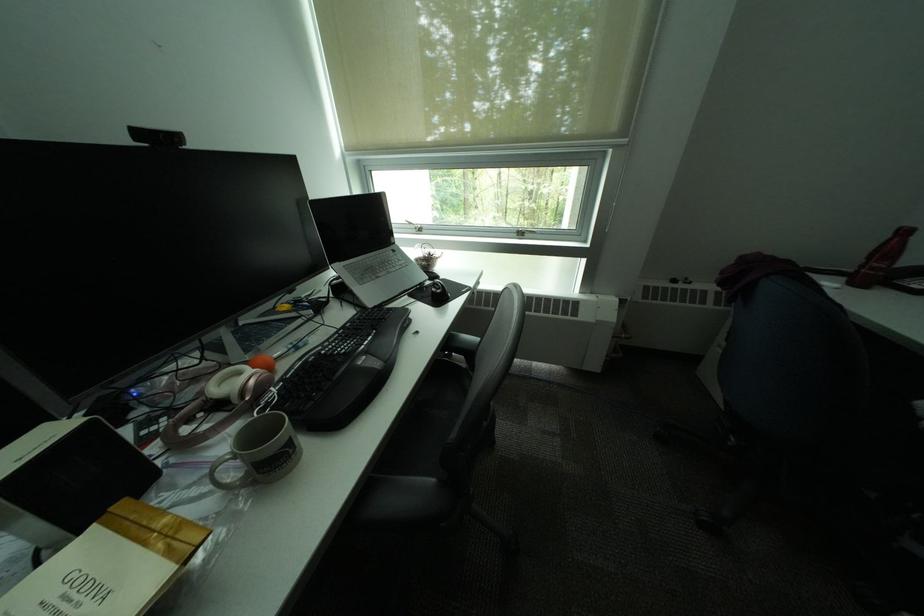
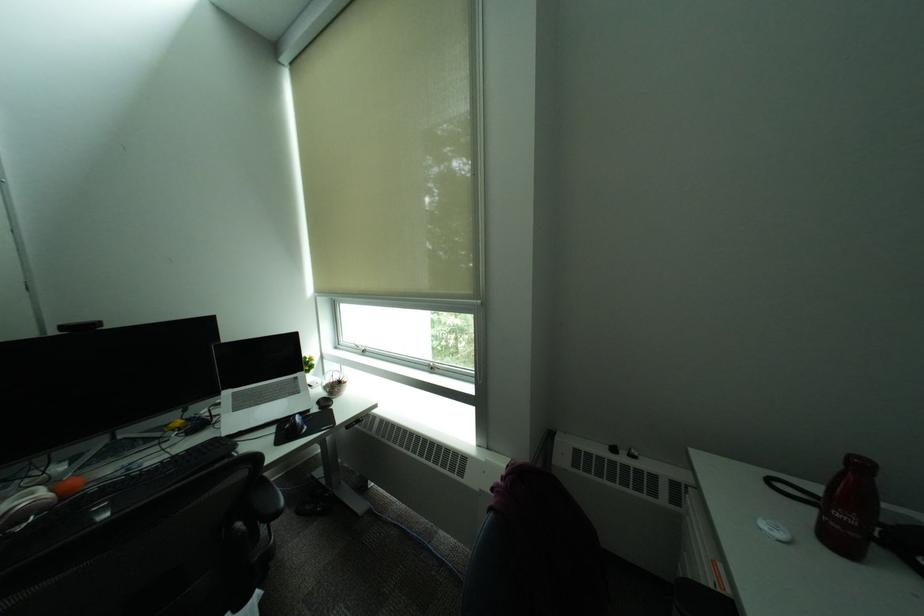
Question: The images are taken continuously from a first-person perspective. In which direction are you moving?

Choices:
 (A) Left
 (B) Right
 (C) Forward
 (D) Backward

Answer: (B)